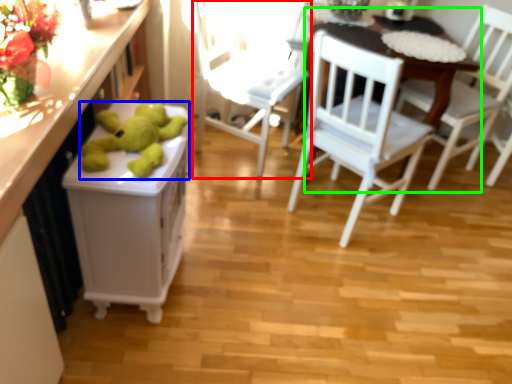
Question: Based on their relative distances, which object is nearer to chair (highlighted by a red box)? Choose from toy (highlighted by a blue box) and table (highlighted by a green box).

Choices:
 (A) toy
 (B) table

Answer: (B)